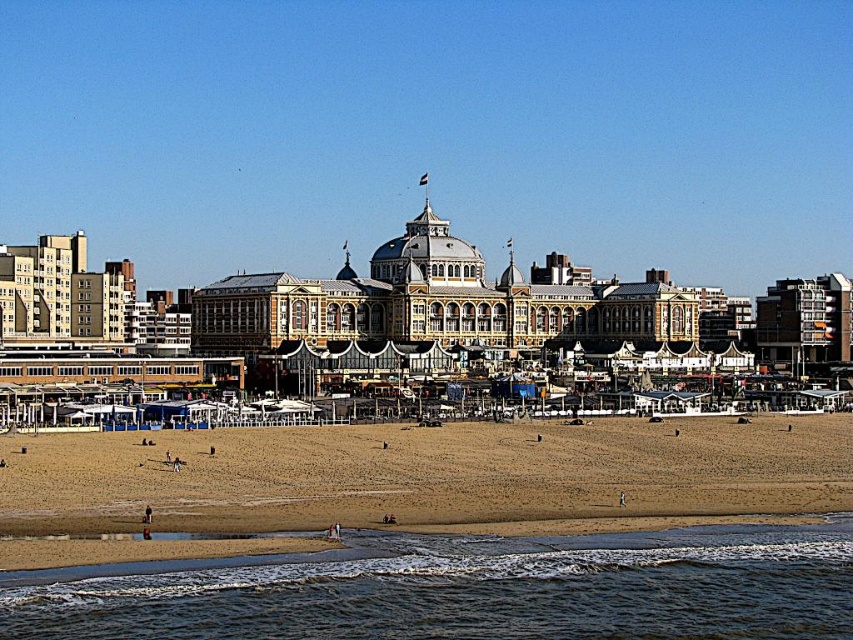
Does clear water at lower left have a smaller size compared to brown sandy beach at lower center?

Indeed, clear water at lower left has a smaller size compared to brown sandy beach at lower center.

Does clear water at lower left lie in front of brown sandy beach at lower center?

Yes, it is in front of brown sandy beach at lower center.

The image size is (853, 640). What are the coordinates of `clear water at lower left` in the screenshot? It's located at (466, 589).